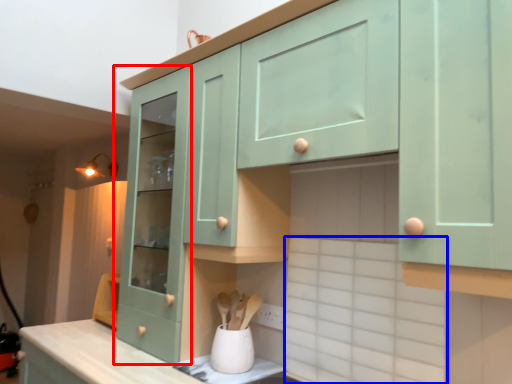
Question: Among these objects, which one is nearest to the camera, cabinetry (highlighted by a red box) or ceramic tile (highlighted by a blue box)?

Choices:
 (A) cabinetry
 (B) ceramic tile

Answer: (B)